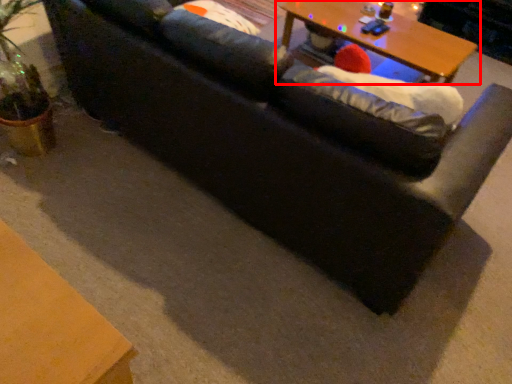
Question: From the image, what is the correct spatial relationship of table (annotated by the red box) in relation to bean bag chair?

Choices:
 (A) left
 (B) right

Answer: (B)